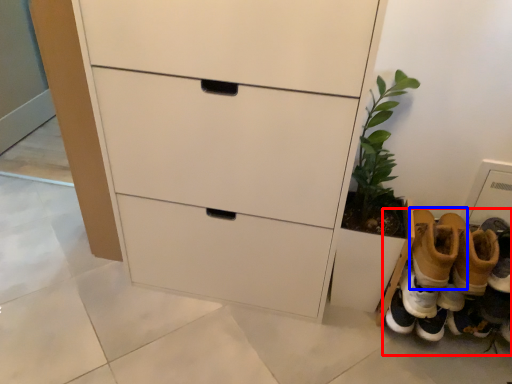
Question: Which object is closer to the camera taking this photo, footwear (highlighted by a red box) or footwear (highlighted by a blue box)?

Choices:
 (A) footwear
 (B) footwear

Answer: (B)